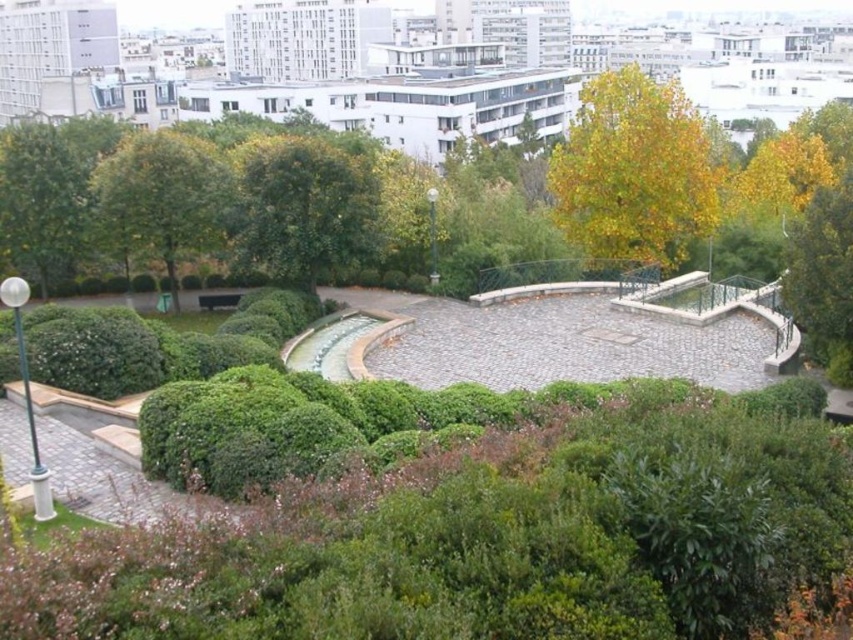
You are standing at the entrance of the park and want to find the green leafy tree at center. According to the coordinates provided, where should you look relative to your position?

The green leafy tree at center is located at point 0.325 on the x and 0.358 on the y axis, so you should look slightly to the right and forward from your current position at the entrance.